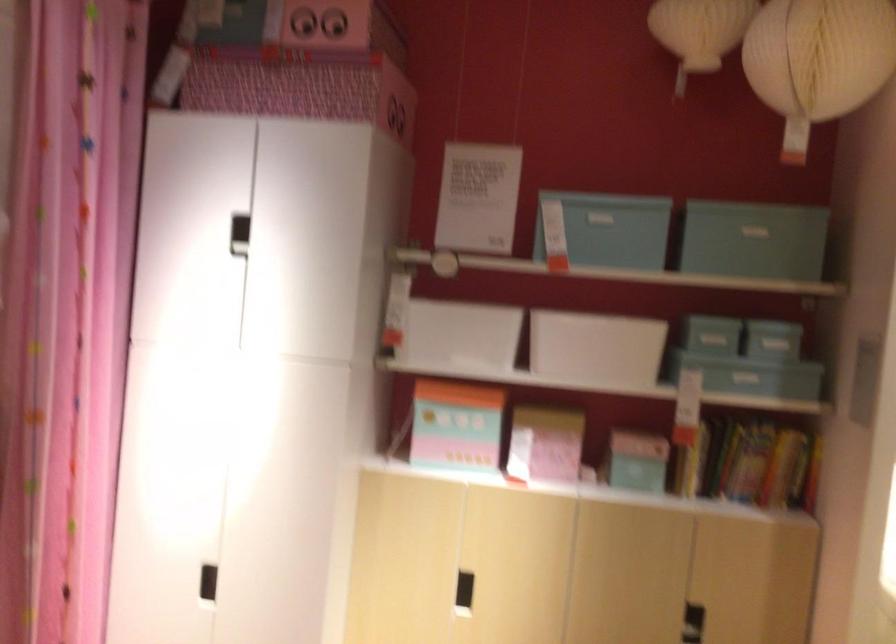
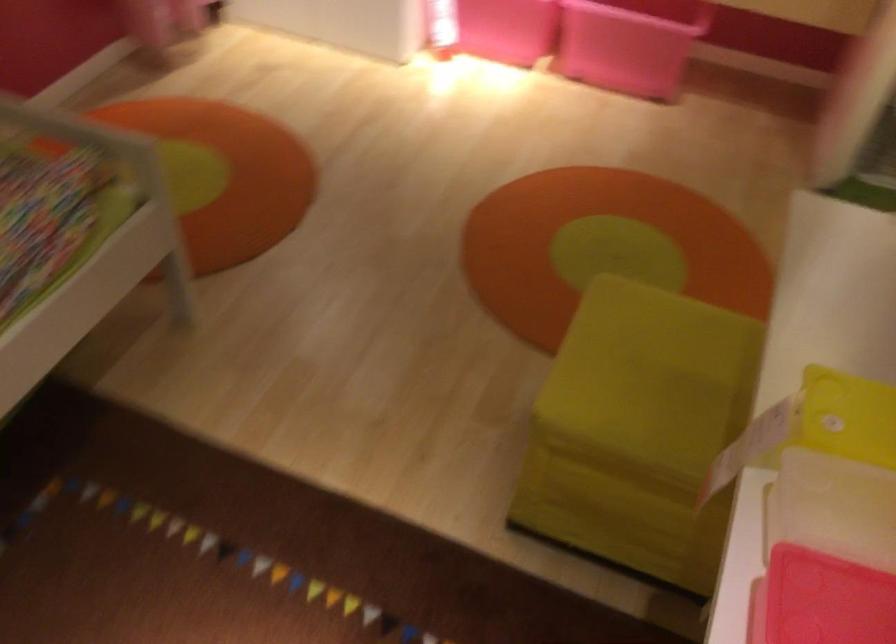
Question: Based on the continuous images, in which direction is the camera rotating? Reply with the corresponding letter.

Choices:
 (A) Left
 (B) Right
 (C) Up
 (D) Down

Answer: (D)